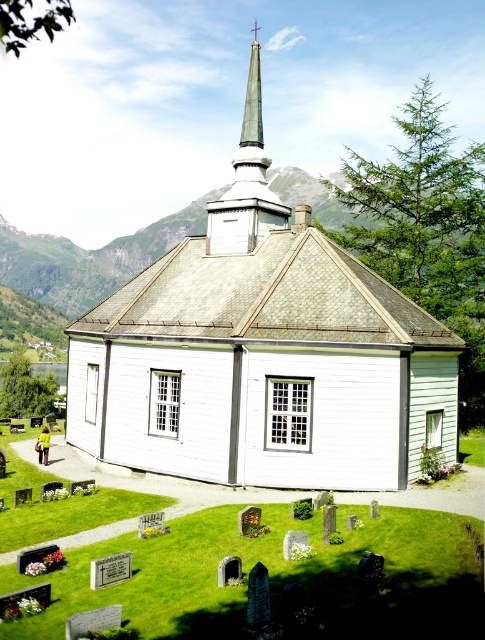
Does white wood church at center lie in front of green polished stone spire at upper center?

Yes.

Can you confirm if white wood church at center is bigger than green polished stone spire at upper center?

Incorrect, white wood church at center is not larger than green polished stone spire at upper center.

The image size is (485, 640). Find the location of `white wood church at center`. white wood church at center is located at coordinates (261, 355).